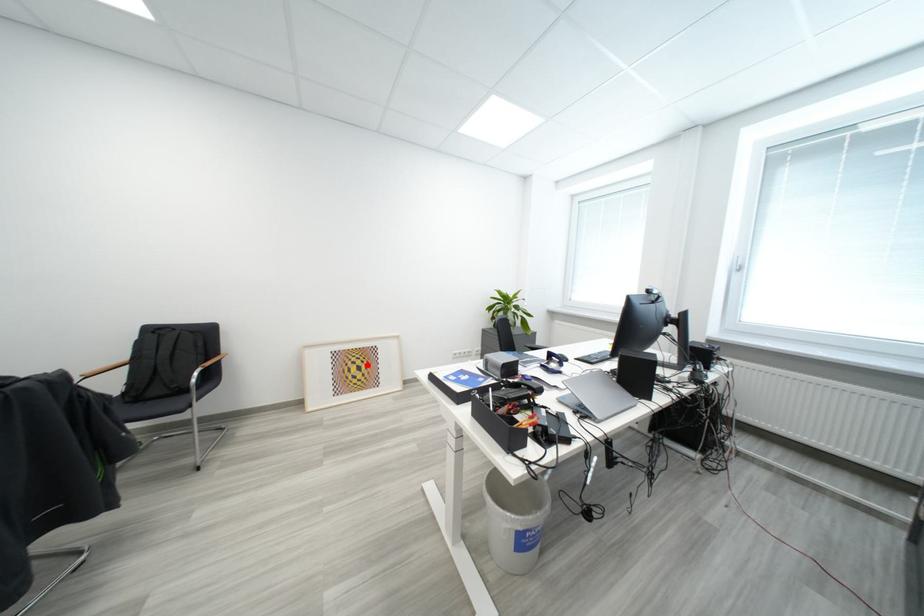
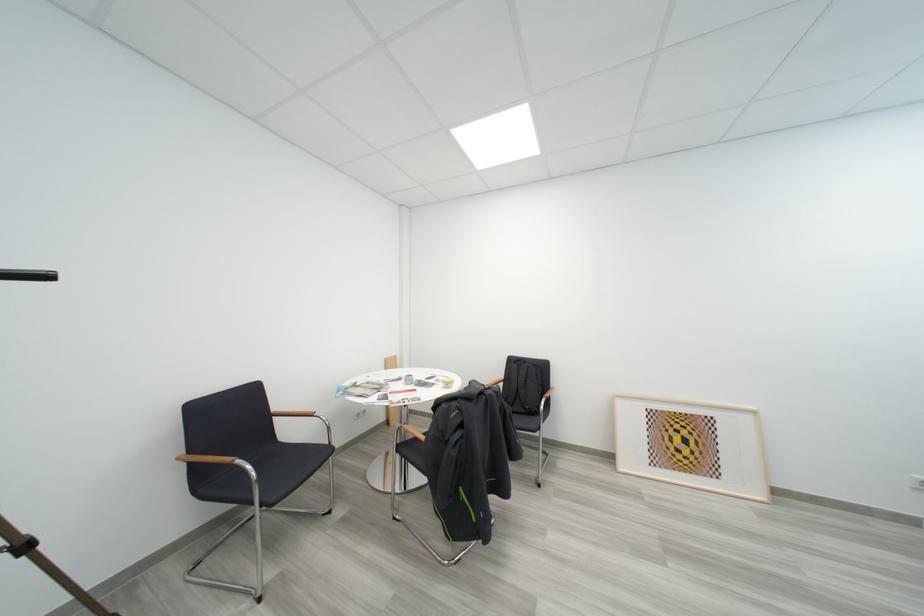
The point at the highlighted location is marked in the first image. Where is the corresponding point in the second image?

(693, 435)